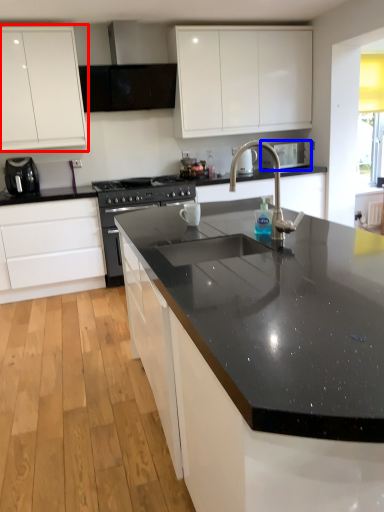
Question: Which object is closer to the camera taking this photo, cabinetry (highlighted by a red box) or appliance (highlighted by a blue box)?

Choices:
 (A) cabinetry
 (B) appliance

Answer: (A)